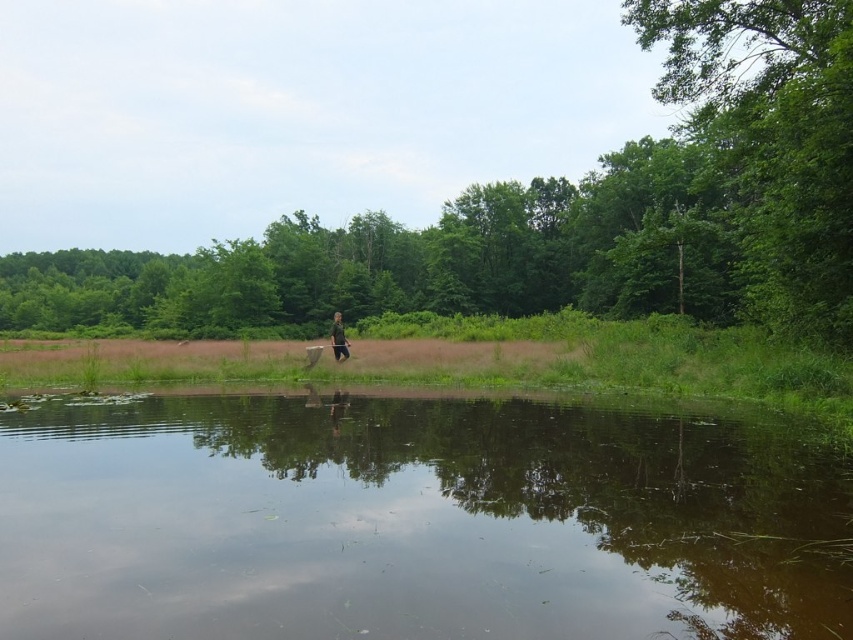
Question: Can you confirm if brown reflective water at center is positioned above green leafy tree at center?

Choices:
 (A) yes
 (B) no

Answer: (B)

Question: Which point is closer to the camera?

Choices:
 (A) brown reflective water at center
 (B) green leafy tree at center
 (C) green fabric person at center

Answer: (A)

Question: Which of the following is the closest to the observer?

Choices:
 (A) (555, 282)
 (B) (341, 330)

Answer: (B)

Question: Which of the following is the farthest from the observer?

Choices:
 (A) (337, 352)
 (B) (672, 138)
 (C) (88, 628)

Answer: (B)

Question: Does brown reflective water at center appear on the left side of green leafy tree at center?

Choices:
 (A) yes
 (B) no

Answer: (A)

Question: Does brown reflective water at center appear on the right side of green leafy tree at center?

Choices:
 (A) no
 (B) yes

Answer: (A)